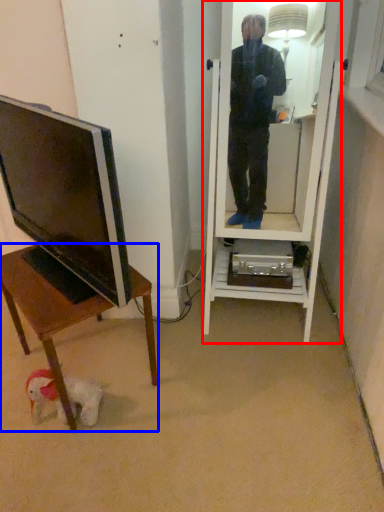
Question: Which object appears farthest to the camera in this image, mirror (highlighted by a red box) or desk (highlighted by a blue box)?

Choices:
 (A) mirror
 (B) desk

Answer: (B)